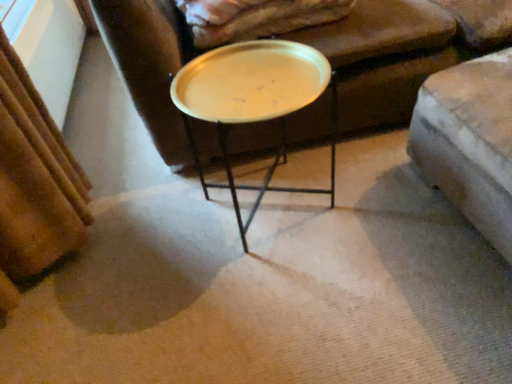
I want to click on velvet beige blanket at upper center, so click(x=255, y=18).

This screenshot has height=384, width=512. Describe the element at coordinates (255, 18) in the screenshot. I see `velvet beige blanket at upper center` at that location.

Describe the element at coordinates (253, 100) in the screenshot. I see `metallic gold tray at center` at that location.

Find the location of a particular element. This screenshot has width=512, height=384. metallic gold tray at center is located at coordinates (253, 100).

Where is `velvet beige blanket at upper center`? The image size is (512, 384). velvet beige blanket at upper center is located at coordinates (255, 18).

Can you confirm if metallic gold tray at center is positioned to the left of velvet beige blanket at upper center?

Indeed, metallic gold tray at center is positioned on the left side of velvet beige blanket at upper center.

Between metallic gold tray at center and velvet beige blanket at upper center, which one is positioned behind?

velvet beige blanket at upper center is further away from the camera.

Considering the points (320, 81) and (214, 6), which point is in front, point (320, 81) or point (214, 6)?

The point (320, 81) is more forward.

From the image's perspective, is metallic gold tray at center under velvet beige blanket at upper center?

Indeed, from the image's perspective, metallic gold tray at center is shown beneath velvet beige blanket at upper center.

From a real-world perspective, is metallic gold tray at center beneath velvet beige blanket at upper center?

Correct, in the physical world, metallic gold tray at center is lower than velvet beige blanket at upper center.

Which object is wider, metallic gold tray at center or velvet beige blanket at upper center?

Wider between the two is velvet beige blanket at upper center.

Which of these two, metallic gold tray at center or velvet beige blanket at upper center, stands taller?

metallic gold tray at center.

Is metallic gold tray at center bigger than velvet beige blanket at upper center?

Yes, metallic gold tray at center is bigger than velvet beige blanket at upper center.

Is metallic gold tray at center situated inside velvet beige blanket at upper center or outside?

The correct answer is: outside.

Is metallic gold tray at center touching velvet beige blanket at upper center?

There is a gap between metallic gold tray at center and velvet beige blanket at upper center.

Is metallic gold tray at center oriented away from velvet beige blanket at upper center?

Correct, metallic gold tray at center is looking away from velvet beige blanket at upper center.

Identify the location of blanket that appears on the right of metallic gold tray at center. The width and height of the screenshot is (512, 384). (255, 18).

Considering the positions of objects velvet beige blanket at upper center and metallic gold tray at center in the image provided, who is more to the left, velvet beige blanket at upper center or metallic gold tray at center?

metallic gold tray at center.

From the picture: Does velvet beige blanket at upper center come in front of metallic gold tray at center?

No, the depth of velvet beige blanket at upper center is greater than that of metallic gold tray at center.

Which is behind, point (192, 1) or point (265, 181)?

The point (265, 181) is farther from the camera.

From the image's perspective, is velvet beige blanket at upper center above metallic gold tray at center?

Correct, velvet beige blanket at upper center appears higher than metallic gold tray at center in the image.

From a real-world perspective, is velvet beige blanket at upper center on metallic gold tray at center?

Yes, from a real-world perspective, velvet beige blanket at upper center is on top of metallic gold tray at center.

Which of these two, velvet beige blanket at upper center or metallic gold tray at center, is wider?

Wider between the two is velvet beige blanket at upper center.

Is velvet beige blanket at upper center taller than metallic gold tray at center?

In fact, velvet beige blanket at upper center may be shorter than metallic gold tray at center.

Does velvet beige blanket at upper center have a larger size compared to metallic gold tray at center?

No, velvet beige blanket at upper center is not bigger than metallic gold tray at center.

Can metallic gold tray at center be found inside velvet beige blanket at upper center?

Definitely not — metallic gold tray at center is not inside velvet beige blanket at upper center.

Is velvet beige blanket at upper center directly adjacent to metallic gold tray at center?

No, velvet beige blanket at upper center is not next to metallic gold tray at center.

Is velvet beige blanket at upper center oriented towards metallic gold tray at center?

No, velvet beige blanket at upper center does not turn towards metallic gold tray at center.

You are a GUI agent. You are given a task and a screenshot of the screen. Output one action in this format:
    pyautogui.click(x=<x>, y=<y>)
    Task: Click on the blanket on the right side of metallic gold tray at center
    
    Given the screenshot: What is the action you would take?
    pyautogui.click(x=255, y=18)

Where is `blanket above the metallic gold tray at center (from a real-world perspective)`? The width and height of the screenshot is (512, 384). blanket above the metallic gold tray at center (from a real-world perspective) is located at coordinates (255, 18).

Where is `blanket behind the metallic gold tray at center`? The width and height of the screenshot is (512, 384). blanket behind the metallic gold tray at center is located at coordinates (255, 18).